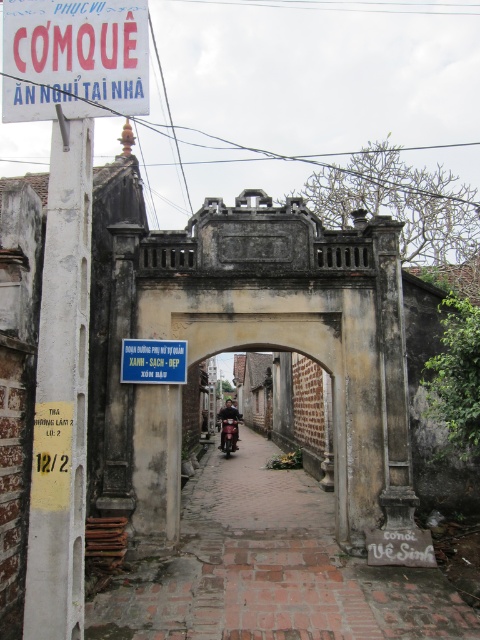
You are a delivery person arriving at the entrance of a residential area. You need to park your metallic red motorbike at center near the red plastic sign at upper left. Can you estimate if the space between them is wide enough for the motorbike to park without touching the sign?

The red plastic sign at upper left might be wider than metallic red motorbike at center, so there is a possibility that the space between them is wide enough for the motorbike to park without touching the sign. However, the exact width isn not specified, so it requires further measurement.

You are a visitor approaching the traditional Vietnamese gate. You see a red plastic sign at upper left and a metallic red motorbike at center. Which object is positioned more to the left?

The red plastic sign at upper left is positioned more to the left than the metallic red motorbike at center.

You are standing in front of the traditional Vietnamese gate. You need to locate the red plastic sign at upper left. Where exactly is it positioned relative to the gate?

The red plastic sign at upper left is positioned at the coordinates point (x=74, y=58) relative to the gate.